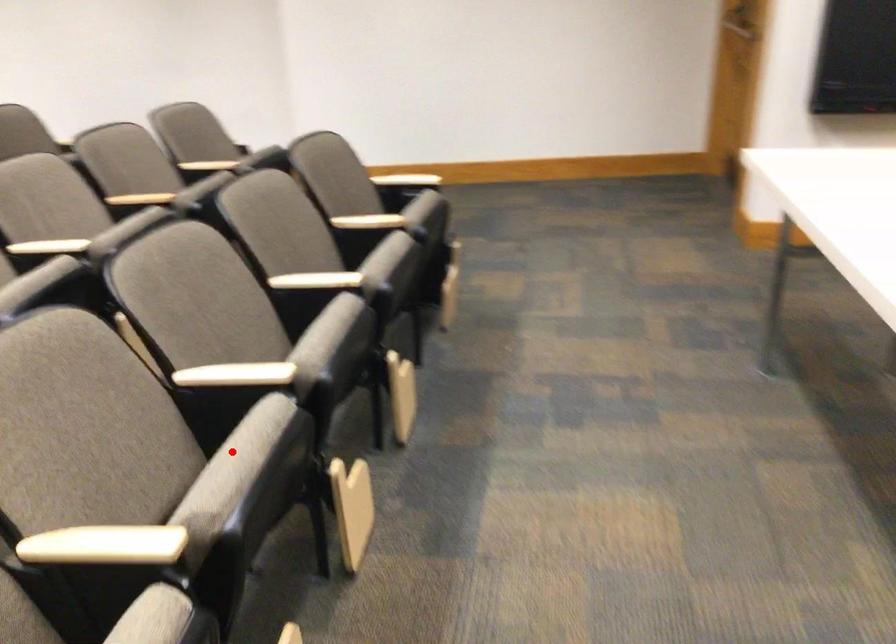
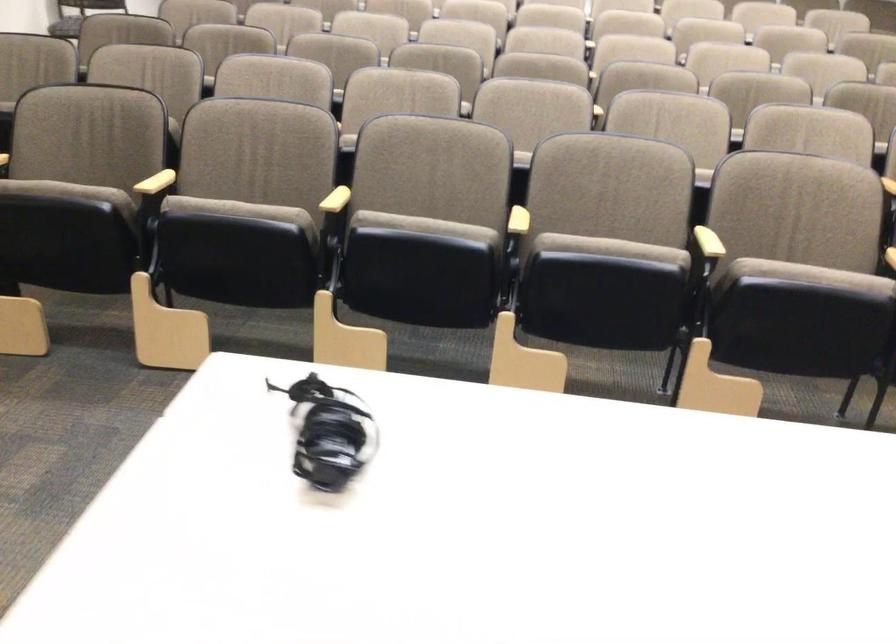
Question: I am providing you with two images of the same scene from different viewpoints. A red point is shown in image1. For the corresponding object point in image2, is it positioned nearer or farther from the camera?

Choices:
 (A) Nearer
 (B) Farther

Answer: (B)